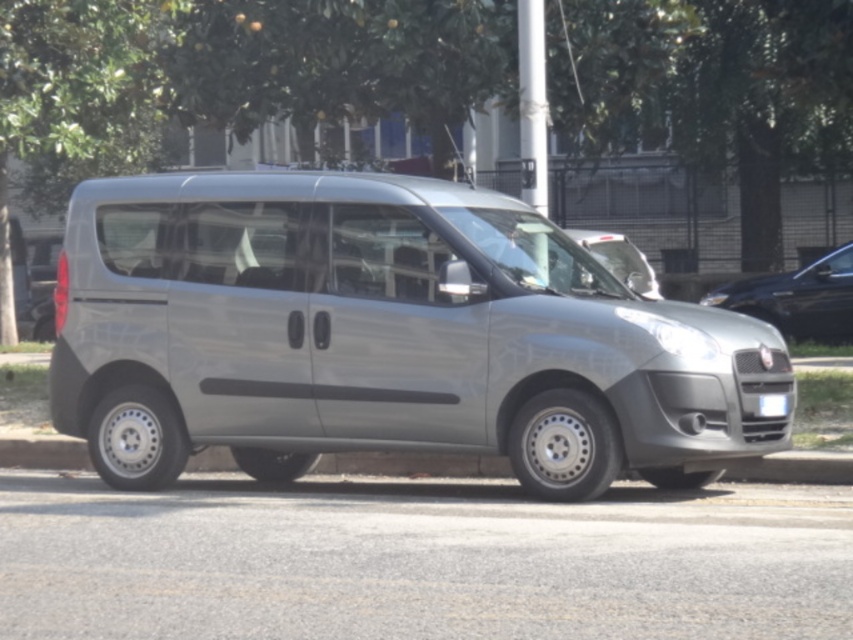
Question: Which of these objects is positioned farthest from the silver metallic van at center?

Choices:
 (A) gray concrete curb at lower left
 (B) green leafy tree at upper center
 (C) white plastic license plate at center
 (D) satin silver van at center

Answer: (C)

Question: Which point is closer to the camera taking this photo?

Choices:
 (A) (767, 308)
 (B) (775, 474)

Answer: (B)

Question: Does satin silver van at center appear on the left side of gray concrete curb at lower left?

Choices:
 (A) yes
 (B) no

Answer: (A)

Question: Is green leafy tree at upper center thinner than silver metallic van at center?

Choices:
 (A) yes
 (B) no

Answer: (B)

Question: Among these points, which one is nearest to the camera?

Choices:
 (A) (242, 44)
 (B) (844, 268)
 (C) (822, 465)
 (D) (779, 412)

Answer: (D)

Question: Can you confirm if satin silver van at center is smaller than silver metallic van at center?

Choices:
 (A) no
 (B) yes

Answer: (A)